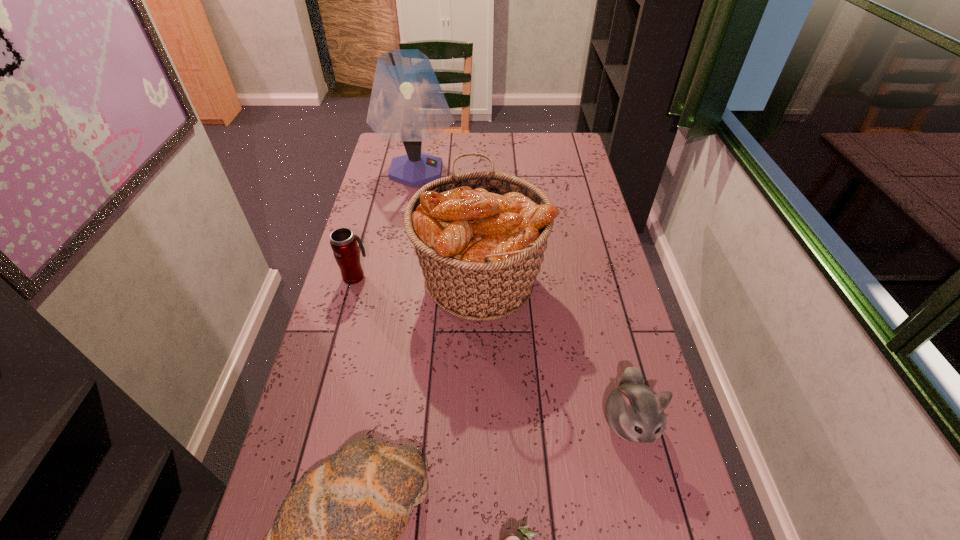
The height and width of the screenshot is (540, 960). What are the coordinates of `lampshade` in the screenshot? It's located at (407, 104).

Image resolution: width=960 pixels, height=540 pixels. Identify the location of the farthest object. (407, 104).

I want to click on the second tallest object, so click(480, 237).

Identify the location of thermos bottle. (343, 242).

Identify the location of hamster. (634, 412).

Locate an element on the screen. The height and width of the screenshot is (540, 960). vacant space located 0.060m on the base of the farthest object is located at coordinates (471, 170).

At what (x,y) coordinates should I click in order to perform the action: click on free space located 0.220m on the right of the basket. Please return your answer as a coordinate pair (x, y). Looking at the image, I should click on (613, 278).

The image size is (960, 540). I want to click on vacant region located 0.160m on the side with the handle of the thermos bottle, so click(366, 235).

Locate an element on the screen. vacant region located on the side with the handle of the thermos bottle is located at coordinates (371, 218).

This screenshot has width=960, height=540. I want to click on vacant area located 0.110m on the side with the handle of the thermos bottle, so click(363, 245).